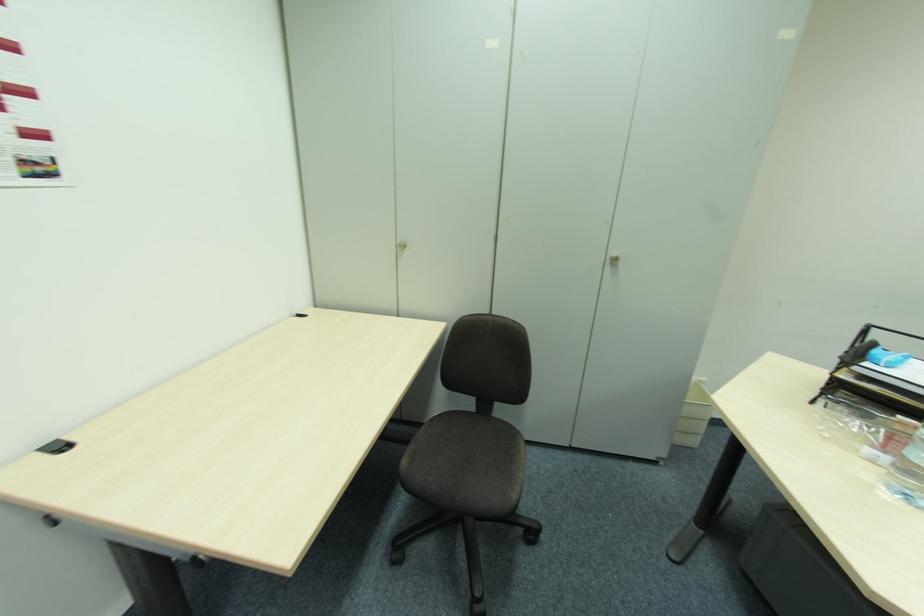
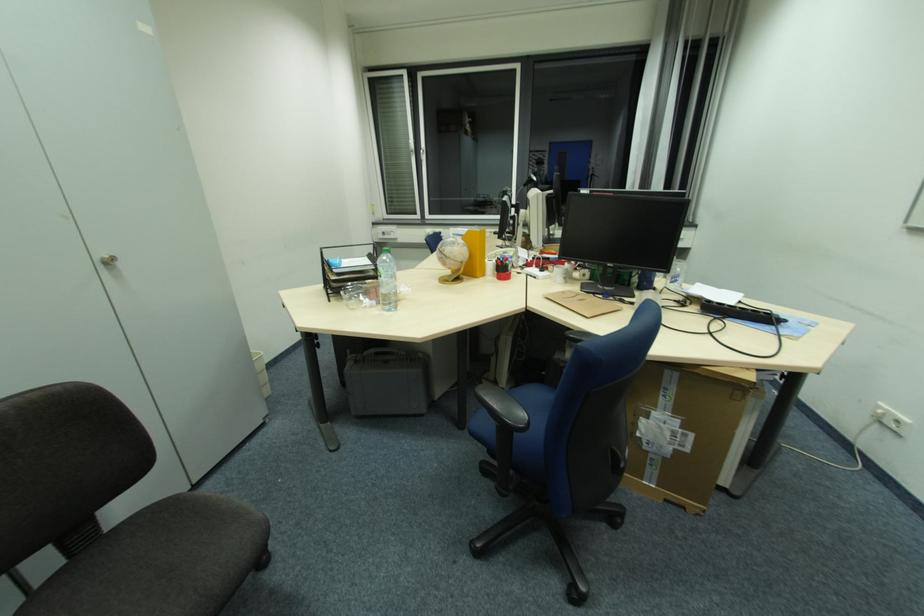
Consider the image. Based on the continuous images, in which direction is the camera rotating?

The camera rotated toward right-down.